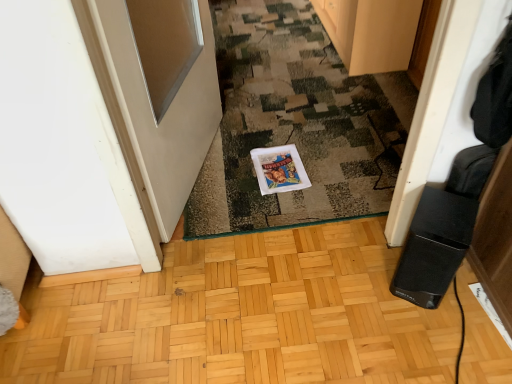
Where is `vacant region above black plastic speaker at lower right (from a real-world perspective)`? The image size is (512, 384). vacant region above black plastic speaker at lower right (from a real-world perspective) is located at coordinates (445, 214).